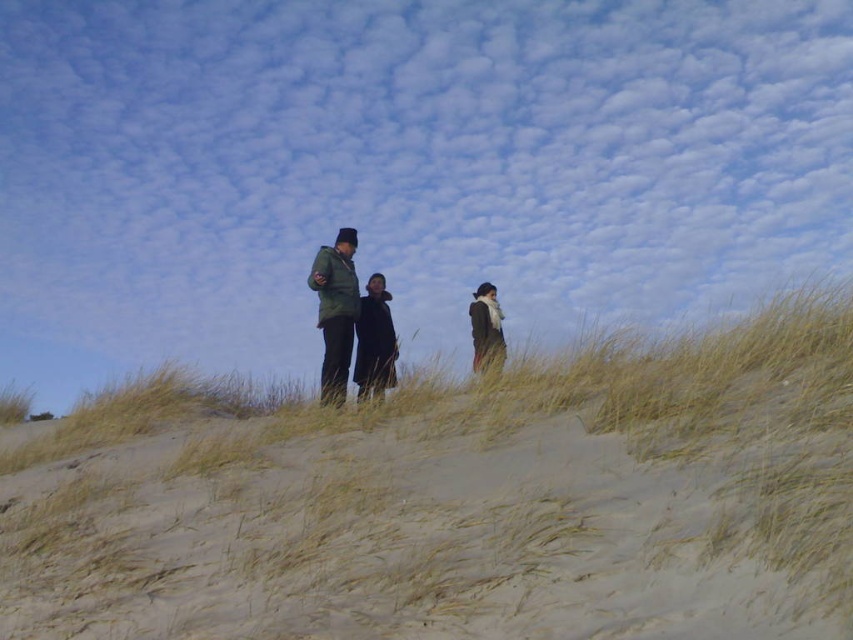
Which of these two, dark green jacket at center or dark brown scarf at right, stands taller?

dark green jacket at center

Can you confirm if dark green jacket at center is positioned above dark brown scarf at right?

No.

Measure the distance between point (360,360) and camera.

A distance of 34.36 feet exists between point (360,360) and camera.

Where is `dark green jacket at center`? dark green jacket at center is located at coordinates (374, 340).

Which is behind, point (456, 504) or point (474, 296)?

Positioned behind is point (474, 296).

Which is more to the right, dry grass at center or dark brown scarf at right?

Positioned to the right is dry grass at center.

Who is more distant from viewer, (x=56, y=499) or (x=492, y=292)?

Point (x=492, y=292)

Identify the location of dry grass at center. (456, 499).

Which is in front, point (341, 304) or point (494, 321)?

Point (341, 304)

What do you see at coordinates (335, 310) in the screenshot? The image size is (853, 640). I see `green matte jacket at center` at bounding box center [335, 310].

Is point (329, 314) closer to camera compared to point (490, 358)?

That is False.

Find the location of a particular element. Image resolution: width=853 pixels, height=640 pixels. green matte jacket at center is located at coordinates (335, 310).